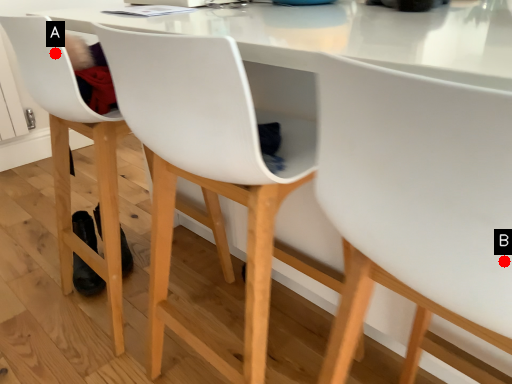
Question: Two points are circled on the image, labeled by A and B beside each circle. Which of the following is the closest to the observer?

Choices:
 (A) A is closer
 (B) B is closer

Answer: (B)